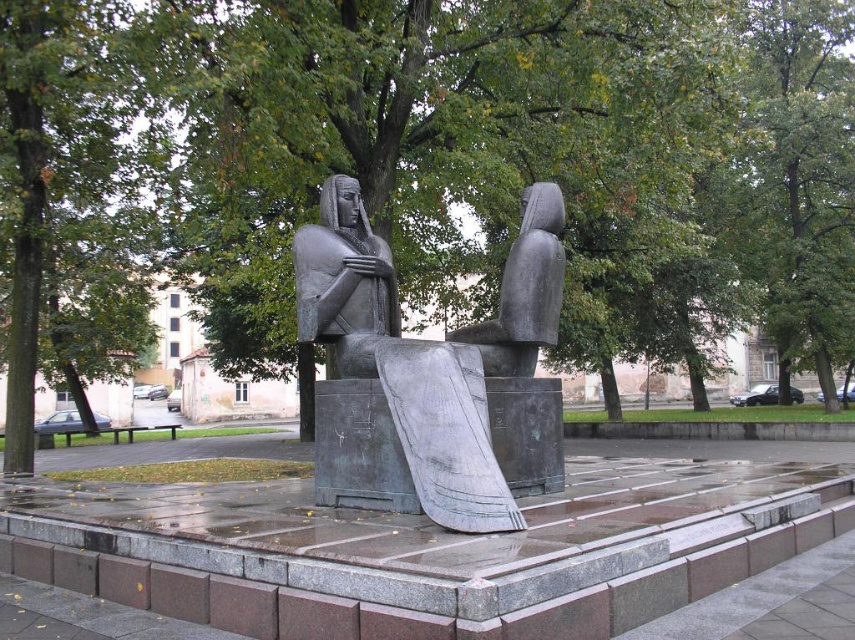
Which of these two, green leafy tree at center or bronze statue at center, stands taller?

green leafy tree at center

Who is higher up, green leafy tree at center or bronze statue at center?

green leafy tree at center

What do you see at coordinates (529, 141) in the screenshot? I see `green leafy tree at center` at bounding box center [529, 141].

This screenshot has width=855, height=640. I want to click on green leafy tree at center, so click(529, 141).

Which of these two, bronze statue at center or polished bronze statue at center, stands shorter?

With less height is polished bronze statue at center.

Does bronze statue at center come behind polished bronze statue at center?

That is False.

Who is more distant from viewer, (407,404) or (534,291)?

The point (534,291) is behind.

Image resolution: width=855 pixels, height=640 pixels. I want to click on bronze statue at center, so click(399, 365).

Is green leafy tree at center thinner than polished bronze statue at center?

In fact, green leafy tree at center might be wider than polished bronze statue at center.

Is green leafy tree at center below polished bronze statue at center?

No, green leafy tree at center is not below polished bronze statue at center.

Does point (216, 29) come behind point (540, 198)?

Yes, point (216, 29) is behind point (540, 198).

Find the location of a particular element. The width and height of the screenshot is (855, 640). green leafy tree at center is located at coordinates (529, 141).